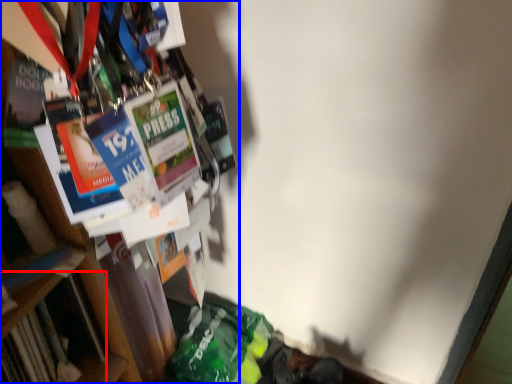
Question: Which object is closer to the camera taking this photo, book (highlighted by a red box) or bookcase (highlighted by a blue box)?

Choices:
 (A) book
 (B) bookcase

Answer: (B)